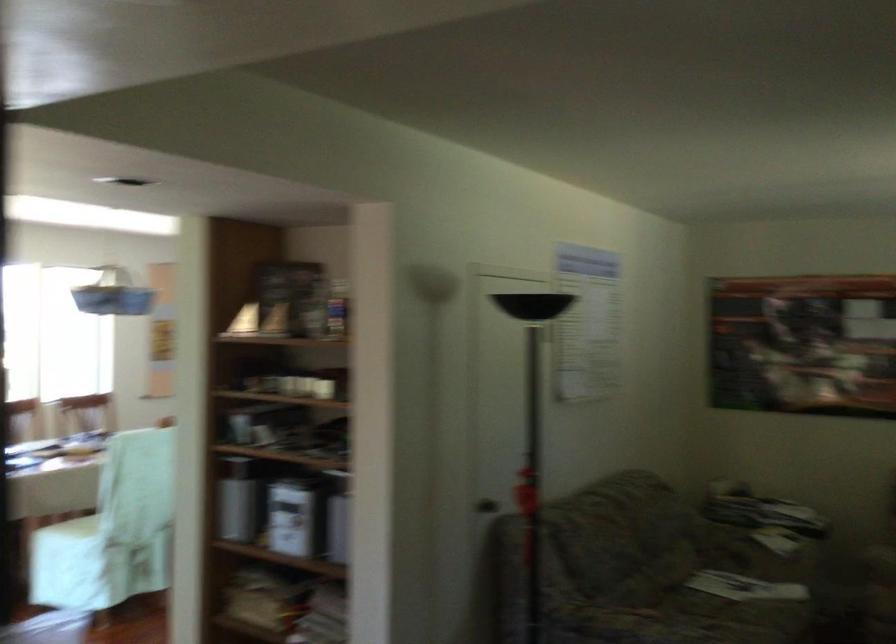
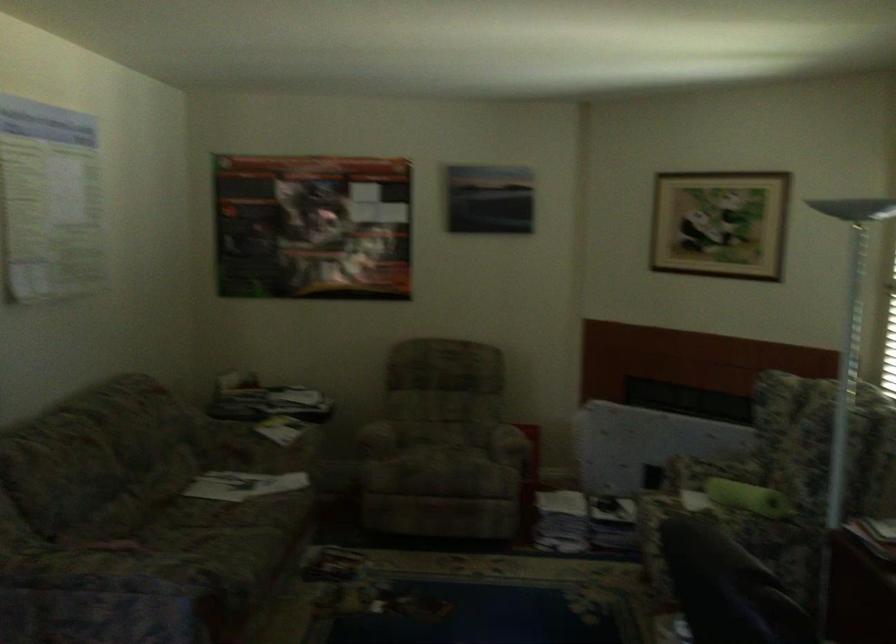
Where in the second image is the point corresponding to (806,515) from the first image?

(377, 438)